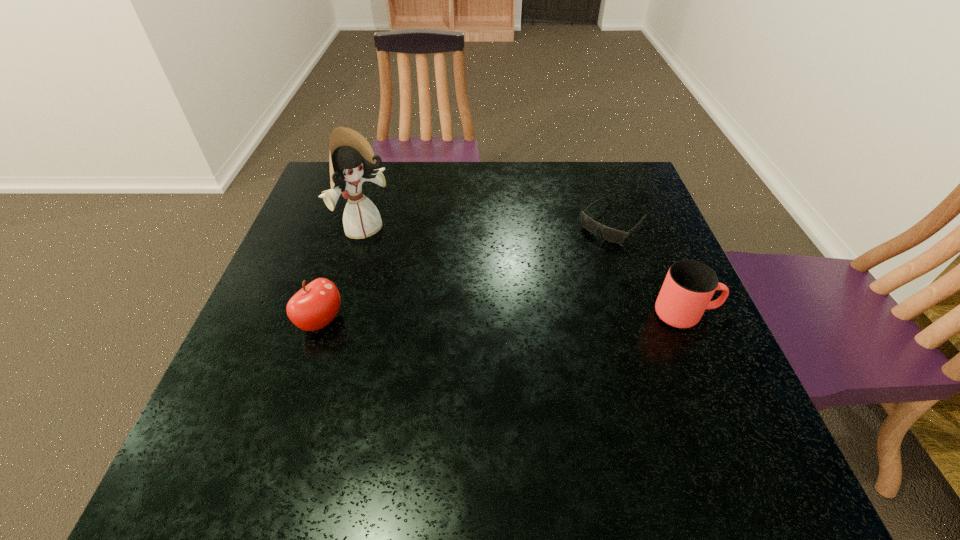
Locate an element on the screen. The height and width of the screenshot is (540, 960). apple is located at coordinates (313, 307).

Where is `cup`? The width and height of the screenshot is (960, 540). cup is located at coordinates (689, 285).

The image size is (960, 540). I want to click on the tallest object, so click(352, 162).

At what (x,y) coordinates should I click in order to perform the action: click on the shortest object. Please return your answer as a coordinate pair (x, y). This screenshot has width=960, height=540. Looking at the image, I should click on (616, 236).

Find the location of `vacant space located on the back of the apple`. vacant space located on the back of the apple is located at coordinates (360, 202).

Identify the location of free spot located at the front face of the tallest object. (409, 267).

Identify the location of vacant space situated at the front face of the tallest object. (465, 313).

Locate an element on the screen. This screenshot has height=540, width=960. free region located 0.160m at the front face of the tallest object is located at coordinates (420, 275).

You are a GUI agent. You are given a task and a screenshot of the screen. Output one action in this format:
    pyautogui.click(x=<x>, y=<y>)
    Task: Click on the blank space located 0.340m on the front-facing side of the sunglasses
    The image size is (960, 540).
    Given the screenshot: What is the action you would take?
    pyautogui.click(x=511, y=316)

Image resolution: width=960 pixels, height=540 pixels. I want to click on vacant region located on the front-facing side of the sunglasses, so click(x=575, y=258).